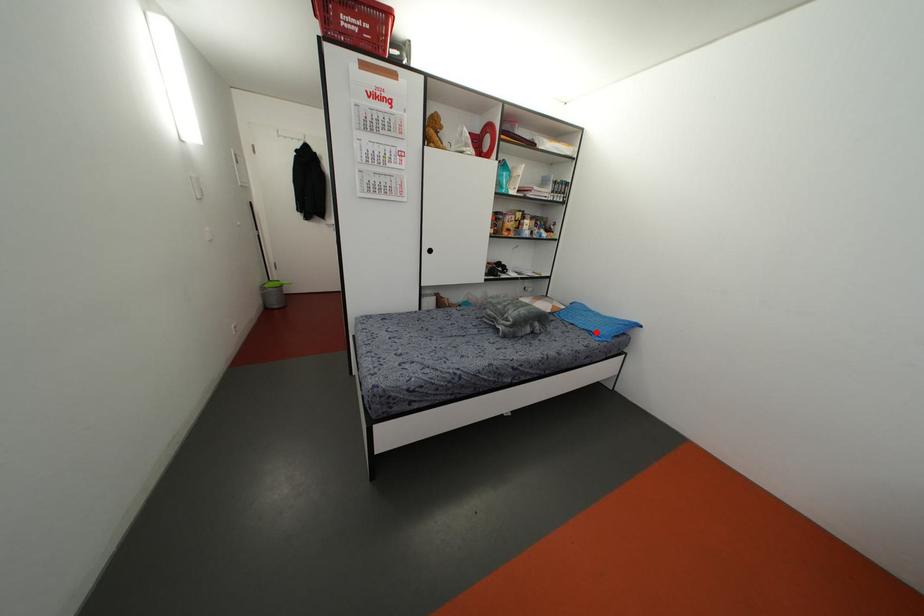
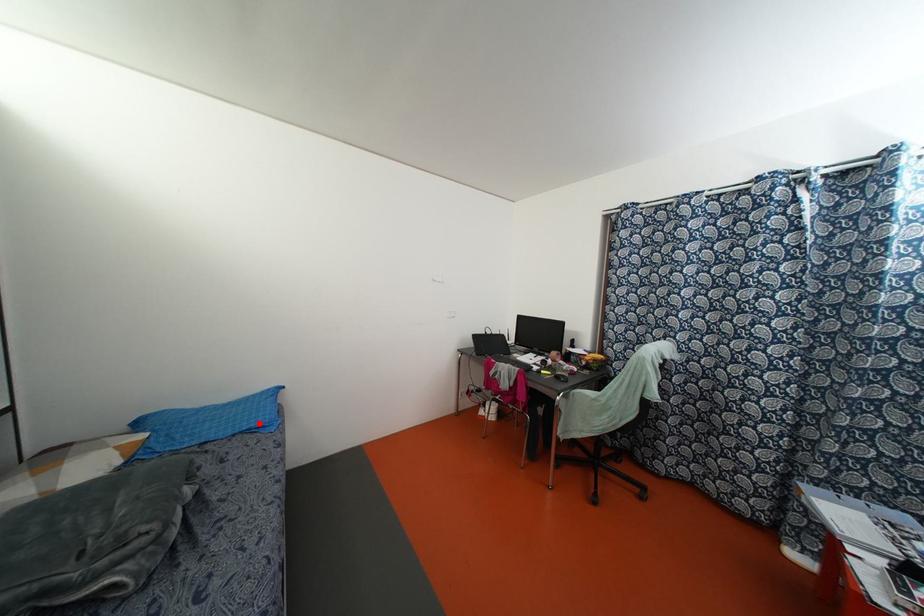
In the scene shown: I am providing you with two images of the same scene from different viewpoints. A red point is marked on the first image and another point is marked on the second image. Are the points marked in image1 and image2 representing the same 3D position?

Yes